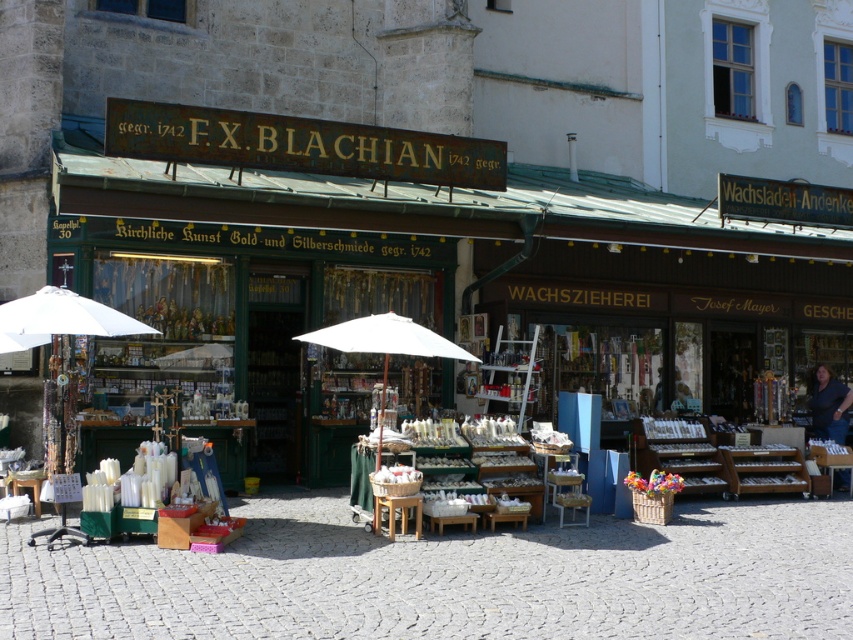
You are a customer standing in front of the historic shop F.X. Blachian. You notice a white fabric umbrella at left and a blue fabric vendor at center. Which object is smaller in size?

The white fabric umbrella at left is smaller in size compared to the blue fabric vendor at center.

You are a tourist standing in front of the historic shop and see the white fabric umbrella at left and the blue fabric vendor at center. Which object is positioned more to the left side of the scene?

The white fabric umbrella at left is positioned more to the left side of the scene than the blue fabric vendor at center.

You are a customer standing in front of the historic shop and see the white fabric umbrella at left and the blue fabric vendor at center. Which object is closer to you?

The white fabric umbrella at left is closer to you because it is in front of the blue fabric vendor at center.